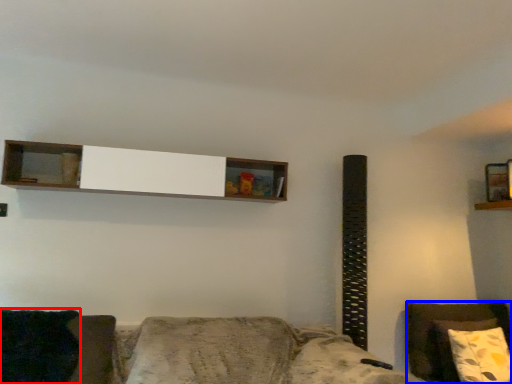
Question: Which object is closer to the camera taking this photo, pillow (highlighted by a red box) or furniture (highlighted by a blue box)?

Choices:
 (A) pillow
 (B) furniture

Answer: (A)